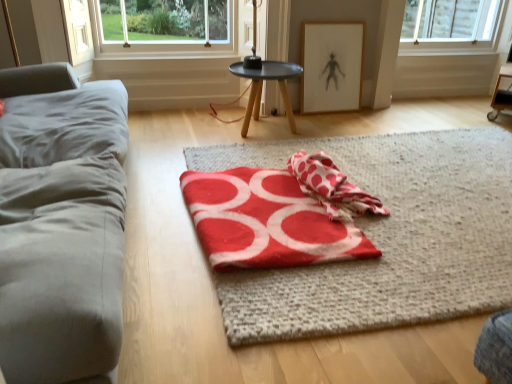
Locate an element on the screen. The image size is (512, 384). free space to the left of matte black table at center is located at coordinates (198, 131).